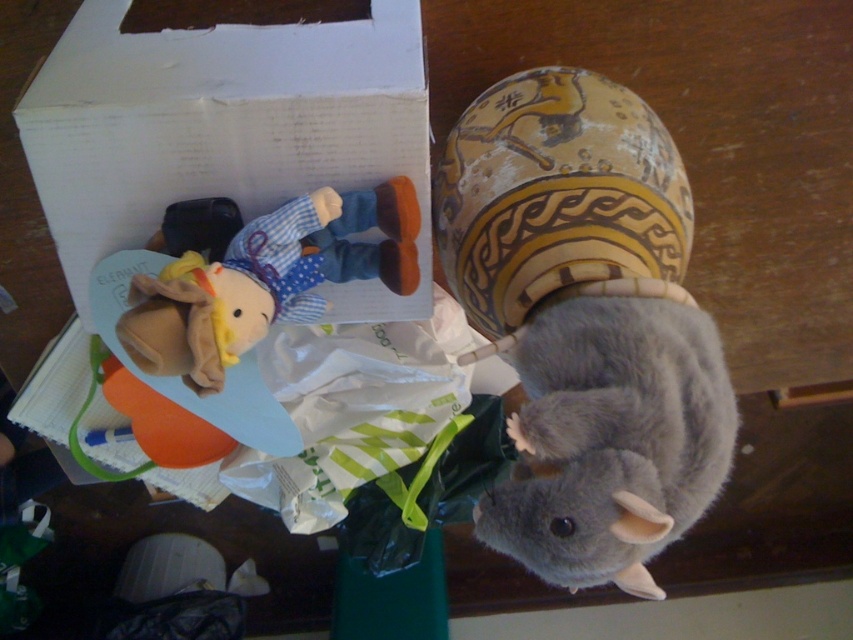
Question: Where is gray soft plush at lower right located in relation to fluffy yellow plush at center in the image?

Choices:
 (A) left
 (B) right

Answer: (B)

Question: Among these objects, which one is nearest to the camera?

Choices:
 (A) fluffy yellow plush at center
 (B) white cardboard box at upper left
 (C) gray soft plush at lower right

Answer: (C)

Question: Which point is farther from the camera taking this photo?

Choices:
 (A) pyautogui.click(x=291, y=237)
 (B) pyautogui.click(x=408, y=77)
 (C) pyautogui.click(x=621, y=586)
 (D) pyautogui.click(x=558, y=500)

Answer: (B)

Question: Is white cardboard box at upper left below gray soft plush at lower right?

Choices:
 (A) no
 (B) yes

Answer: (A)

Question: Observing the image, what is the correct spatial positioning of gray soft plush at lower right in reference to fluffy gray mouse at lower right?

Choices:
 (A) below
 (B) above

Answer: (B)

Question: Which object is positioned farthest from the white cardboard box at upper left?

Choices:
 (A) gray soft plush at lower right
 (B) fluffy yellow plush at center

Answer: (A)